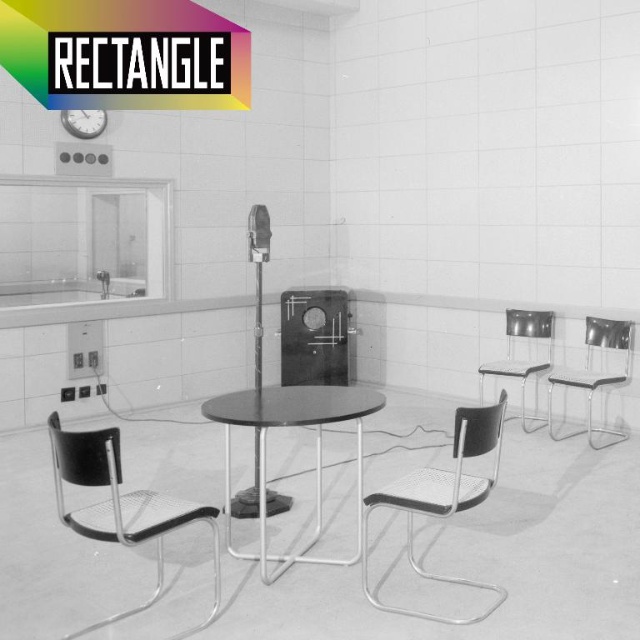
You are organizing a small event in this room and need to place a banner that requires hanging it from the ceiling above the metal mesh chair at right. Is the metallic clock at upper left in a position that might interfere with hanging the banner?

The metal mesh chair at right is positioned under the metallic clock at upper left, so the clock is directly above the chair. This means hanging a banner from the ceiling above the chair would likely interfere with the metallic clock at upper left, as they occupy the same vertical space.

Consider the image. You are standing at point [80,113] and want to walk to point [189,522]. Which direction should you move in relation to the room?

You should move forward towards point [189,522] since it is positioned in front of your current location at point [80,113].

You are in a room with two points marked on the floor. The first point is at coordinate point(301, 349) and the second is at point(520, 396). If you are facing north, which point is closer to your current position?

The point at coordinate point(301, 349) is behind point point(520, 396), so if you are facing north, the point at point(301, 349) would be behind you and farther away from your current position compared to point(520, 396). Therefore, the closer point is point(520, 396).